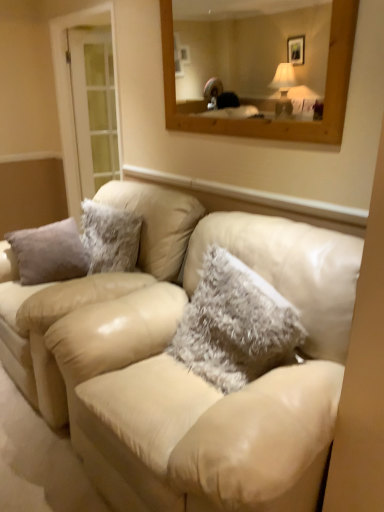
Question: In terms of width, does beige leather couch at center look wider or thinner when compared to fuzzy white pillow at center?

Choices:
 (A) thin
 (B) wide

Answer: (B)

Question: Relative to fuzzy white pillow at center, is beige leather couch at center in front or behind?

Choices:
 (A) front
 (B) behind

Answer: (B)

Question: Considering the real-world distances, which object is closest to the beige leather couch at center?

Choices:
 (A) beige leather couch at center
 (B) clear glass door at left
 (C) fuzzy white pillow at center

Answer: (A)

Question: Estimate the real-world distances between objects in this image. Which object is farther from the beige leather couch at center?

Choices:
 (A) fuzzy white pillow at center
 (B) clear glass door at left
 (C) beige leather couch at center

Answer: (B)